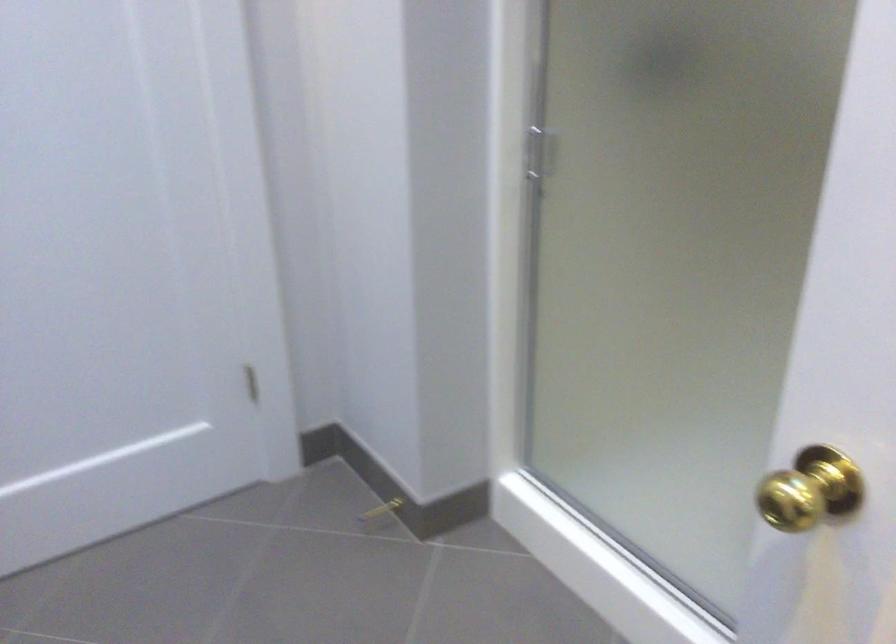
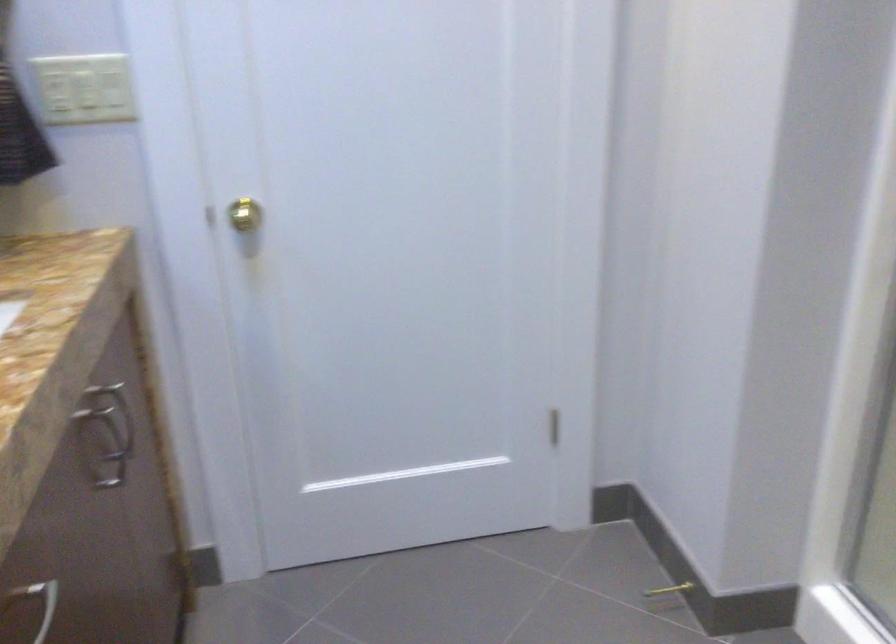
Where in the second image is the point corresponding to [382,518] from the first image?

(666, 596)